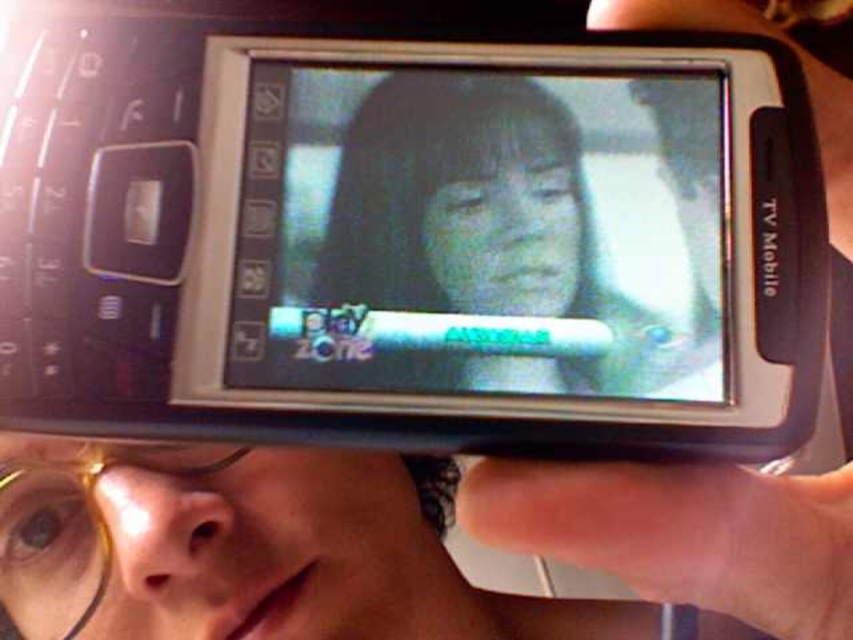
Does smooth skin hand at center have a greater width compared to gold plastic glasses at lower left?

Yes.

Is smooth skin hand at center taller than gold plastic glasses at lower left?

Correct, smooth skin hand at center is much taller as gold plastic glasses at lower left.

Is point (616, 509) positioned before point (62, 586)?

Yes.

This screenshot has height=640, width=853. Identify the location of smooth skin hand at center. (691, 536).

Who is positioned more to the left, smooth skin face at center or gold plastic glasses at lower left?

Positioned to the left is gold plastic glasses at lower left.

Is point (383, 145) behind point (91, 528)?

No.

Identify the location of smooth skin face at center. (491, 230).

Does smooth skin face at center appear on the right side of smooth skin hand at center?

Incorrect, smooth skin face at center is not on the right side of smooth skin hand at center.

Which is below, smooth skin face at center or smooth skin hand at center?

Positioned lower is smooth skin hand at center.

Who is more distant from viewer, (570,163) or (630,496)?

The point (570,163) is more distant.

Locate an element on the screen. Image resolution: width=853 pixels, height=640 pixels. smooth skin face at center is located at coordinates (491, 230).